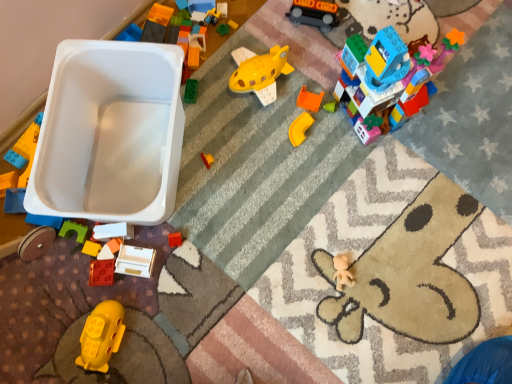
Locate an element on the screen. The width and height of the screenshot is (512, 384). vacant space behind rubberized orange block at lower left, positioned as the eighth toy in right-to-left order is located at coordinates (117, 185).